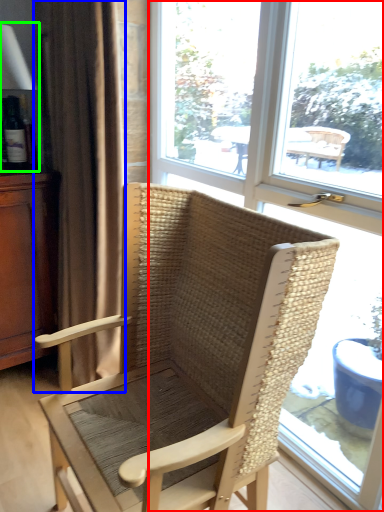
Question: Which object is the farthest from window (highlighted by a red box)? Choose among these: curtain (highlighted by a blue box) or table lamp (highlighted by a green box).

Choices:
 (A) curtain
 (B) table lamp

Answer: (B)